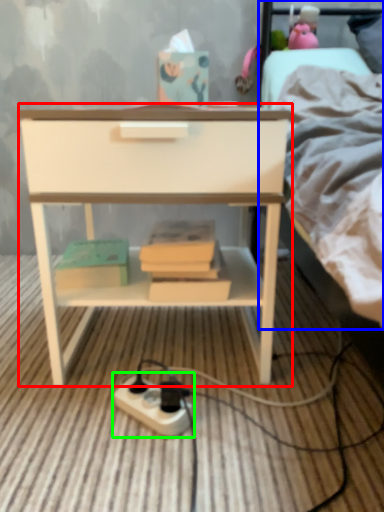
Question: Estimate the real-world distances between objects in this image. Which object is farther from nightstand (highlighted by a red box), bed (highlighted by a blue box) or power plugs and sockets (highlighted by a green box)?

Choices:
 (A) bed
 (B) power plugs and sockets

Answer: (B)